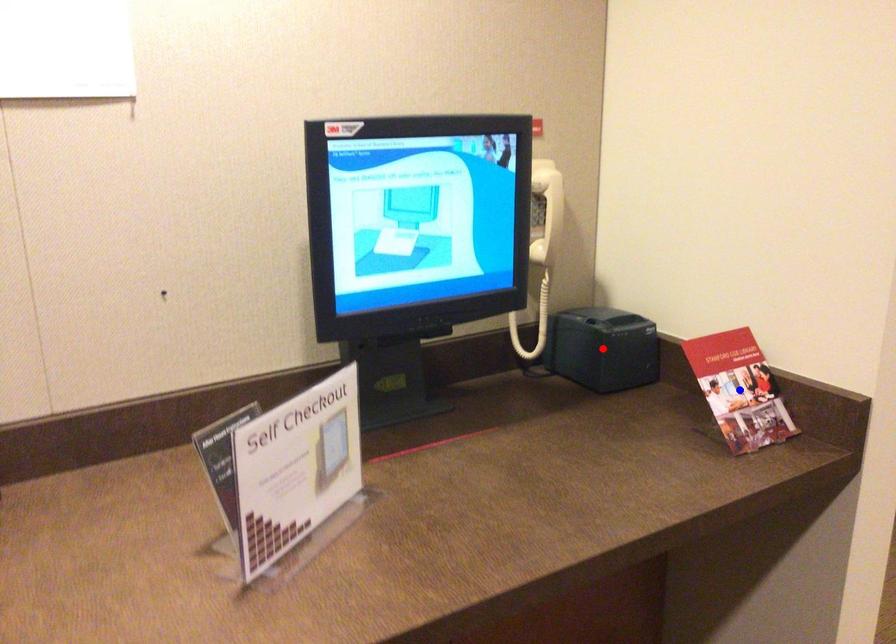
Question: Two points are marked on the image. Which point is closer to the camera?

Choices:
 (A) Blue point is closer.
 (B) Red point is closer.

Answer: (A)